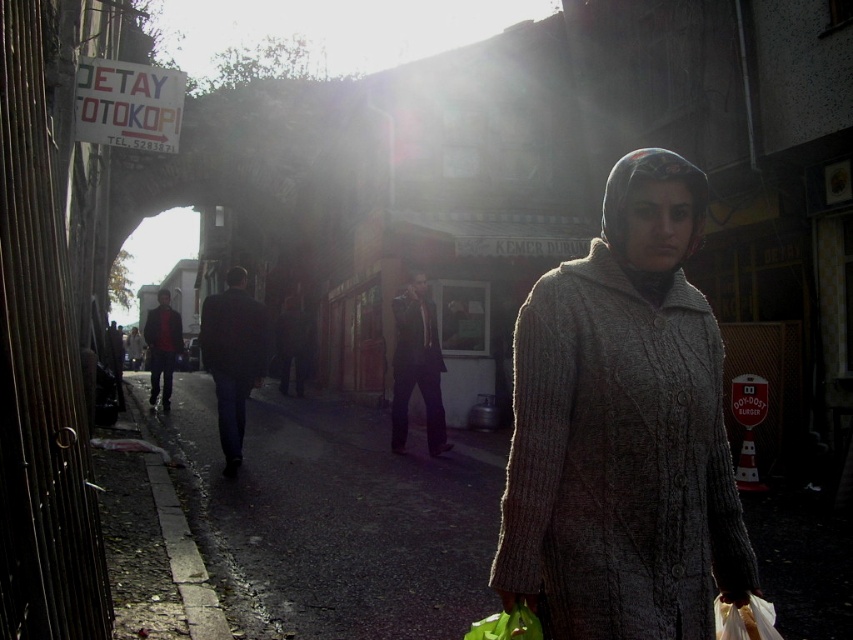
Question: Based on their relative distances, which object is farther from the red sweater at center?

Choices:
 (A) dark suit at center
 (B) dark blue suit at center

Answer: (A)

Question: Does knitted gray coat at center have a greater width compared to red sweater at center?

Choices:
 (A) no
 (B) yes

Answer: (A)

Question: Which point is closer to the camera?

Choices:
 (A) (606, 563)
 (B) (157, 307)
 (C) (426, 417)

Answer: (A)

Question: Is dark blue suit at center below red sweater at center?

Choices:
 (A) no
 (B) yes

Answer: (B)

Question: Is dark blue suit at center to the left of dark suit at center from the viewer's perspective?

Choices:
 (A) no
 (B) yes

Answer: (B)

Question: Which is farther from the knitted gray coat at center?

Choices:
 (A) dark suit at center
 (B) red sweater at center

Answer: (B)